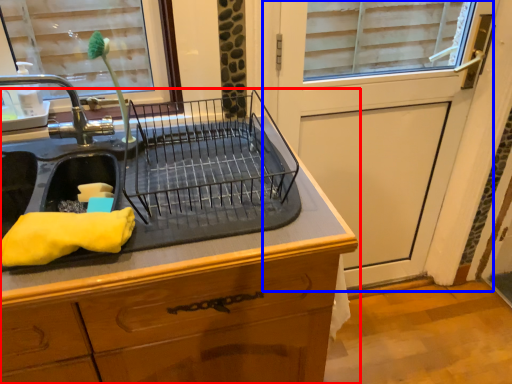
Question: Among these objects, which one is nearest to the camera, countertop (highlighted by a red box) or screen door (highlighted by a blue box)?

Choices:
 (A) countertop
 (B) screen door

Answer: (A)